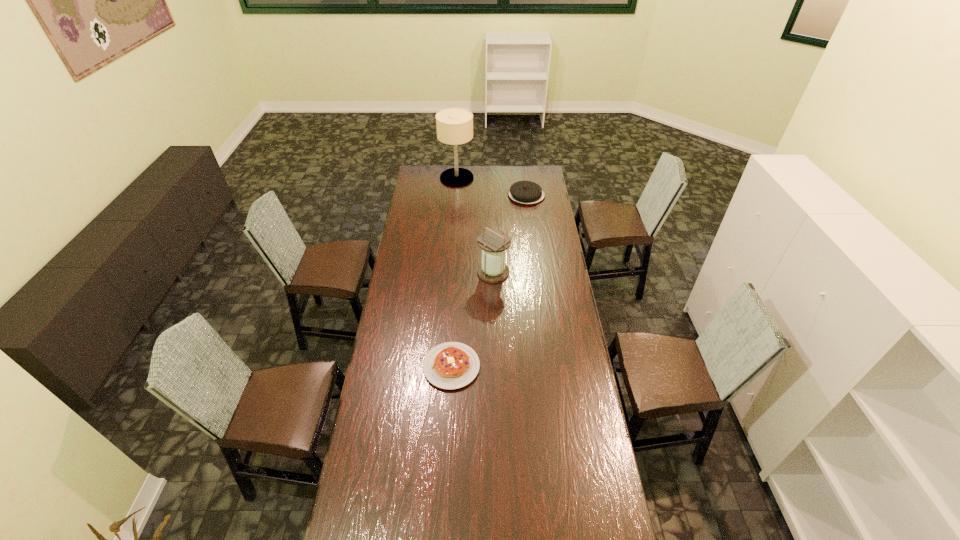
The height and width of the screenshot is (540, 960). Identify the location of free space that satisfies the following two spatial constraints: 1. on the front side of the shortest object; 2. on the right side of the table lamp. (444, 367).

Image resolution: width=960 pixels, height=540 pixels. I want to click on vacant space that satisfies the following two spatial constraints: 1. on the front side of the table lamp; 2. on the left side of the nearer pancake, so click(x=444, y=367).

In order to click on free space that satisfies the following two spatial constraints: 1. on the back side of the third tallest object; 2. on the left side of the shorter pancake in this screenshot , I will do `click(461, 195)`.